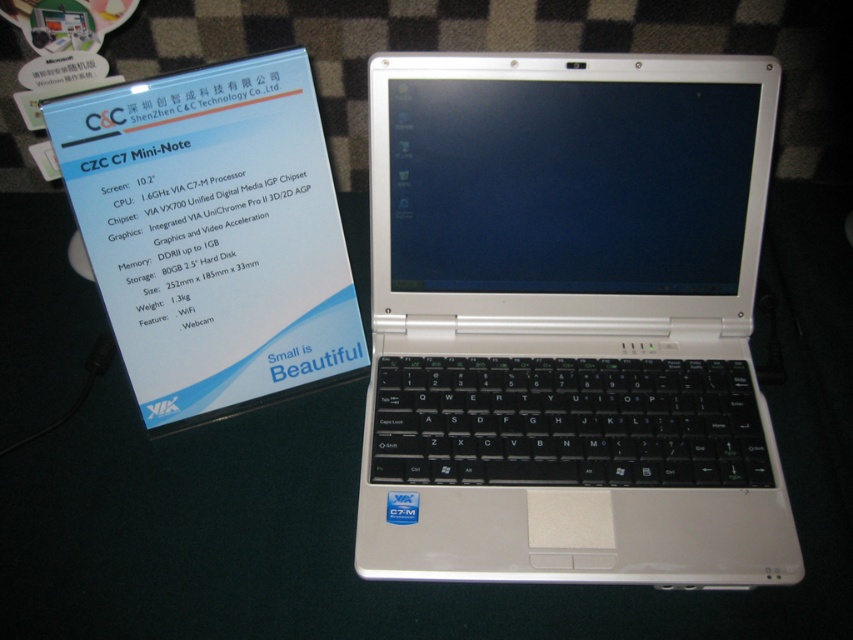
Question: Can you confirm if white plastic laptop at center is positioned to the right of white paper at upper left?

Choices:
 (A) no
 (B) yes

Answer: (B)

Question: Which point is closer to the camera taking this photo?

Choices:
 (A) (833, 256)
 (B) (674, 532)

Answer: (B)

Question: Which point is closer to the camera taking this photo?

Choices:
 (A) tap(56, 138)
 (B) tap(737, 611)

Answer: (A)

Question: In this image, where is white plastic laptop at center located relative to green matte table at center?

Choices:
 (A) below
 (B) above

Answer: (B)

Question: Is white plastic laptop at center thinner than white paper at upper left?

Choices:
 (A) yes
 (B) no

Answer: (B)

Question: Which object is the closest to the green matte table at center?

Choices:
 (A) white paper at upper left
 (B) white plastic laptop at center

Answer: (B)